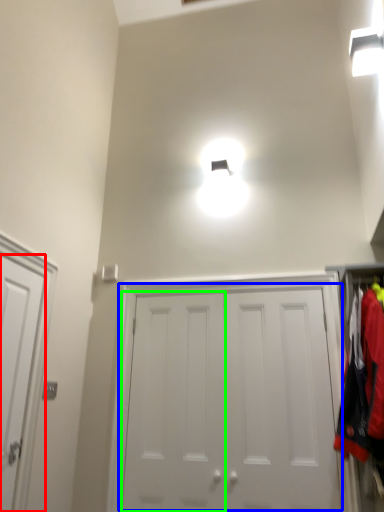
Question: Which object is the closest to the door (highlighted by a red box)? Choose among these: door (highlighted by a blue box) or door (highlighted by a green box).

Choices:
 (A) door
 (B) door

Answer: (B)